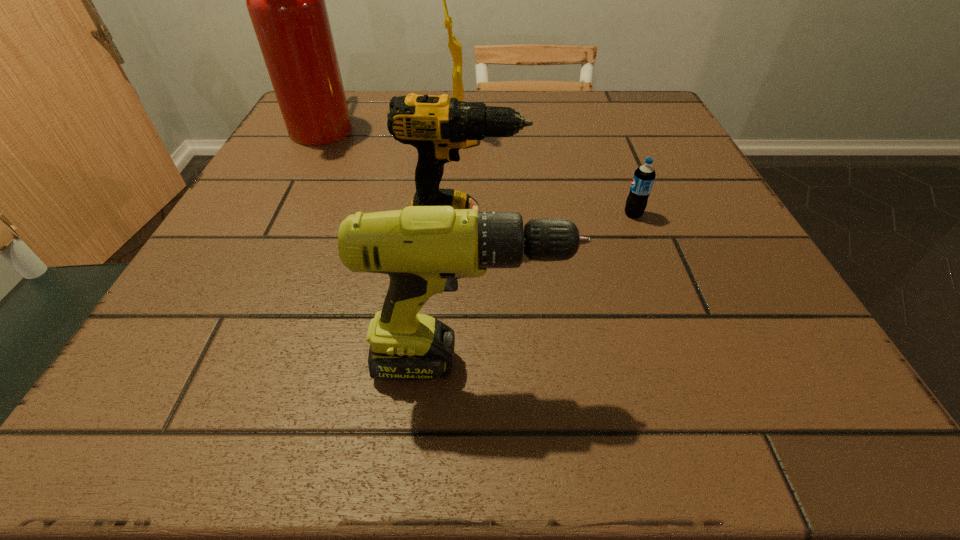
Identify the location of fire extinguisher. This screenshot has width=960, height=540. (285, 0).

Where is `the leftmost object`? the leftmost object is located at coordinates (285, 0).

The image size is (960, 540). I want to click on the fourth shortest object, so click(455, 47).

Image resolution: width=960 pixels, height=540 pixels. I want to click on the nearer drill, so click(424, 249).

Where is `the farther drill`? The height and width of the screenshot is (540, 960). the farther drill is located at coordinates (437, 126).

I want to click on soda bottle, so click(x=644, y=176).

The height and width of the screenshot is (540, 960). What are the coordinates of `the shortest object` in the screenshot? It's located at (644, 176).

Identify the location of vacant space situated 0.250m with the handle and nozzle on the tallest object. (467, 124).

You are a GUI agent. You are given a task and a screenshot of the screen. Output one action in this format:
    pyautogui.click(x=<x>, y=<y>)
    Task: Click on the free region located 0.150m on the front-facing side of the award
    
    Given the screenshot: What is the action you would take?
    pyautogui.click(x=550, y=134)

Find the location of a particular element. Image resolution: width=960 pixels, height=540 pixels. free space located on the handle side of the nearer drill is located at coordinates (723, 363).